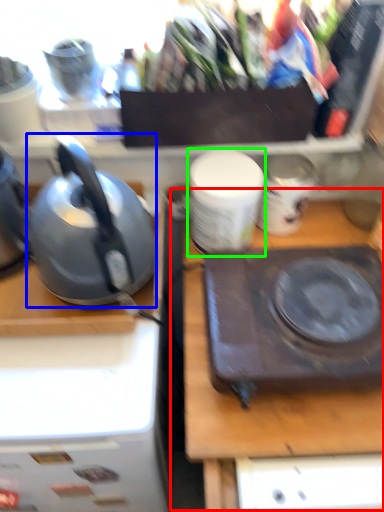
Question: Which object is the farthest from table (highlighted by a red box)? Choose among these: kettle (highlighted by a blue box) or tableware (highlighted by a green box).

Choices:
 (A) kettle
 (B) tableware

Answer: (A)